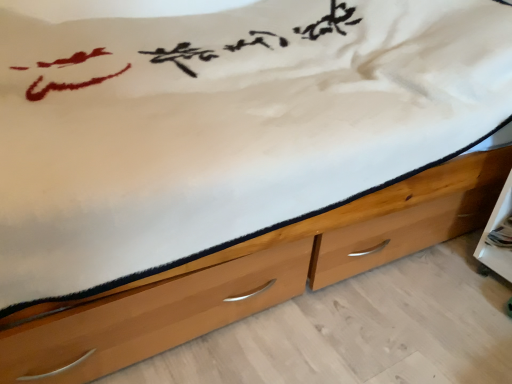
What is the approximate height of light brown wood chest of drawers at lower center?

3.33 centimeters.

In order to face light brown wood chest of drawers at lower center, should I rotate leftwards or rightwards?

You should look right and rotate roughly 16.282 degrees.

Find the location of `light brown wood chest of drawers at lower center`. light brown wood chest of drawers at lower center is located at coordinates (225, 281).

What do you see at coordinates (225, 281) in the screenshot?
I see `light brown wood chest of drawers at lower center` at bounding box center [225, 281].

The height and width of the screenshot is (384, 512). I want to click on light brown wood chest of drawers at lower center, so click(x=225, y=281).